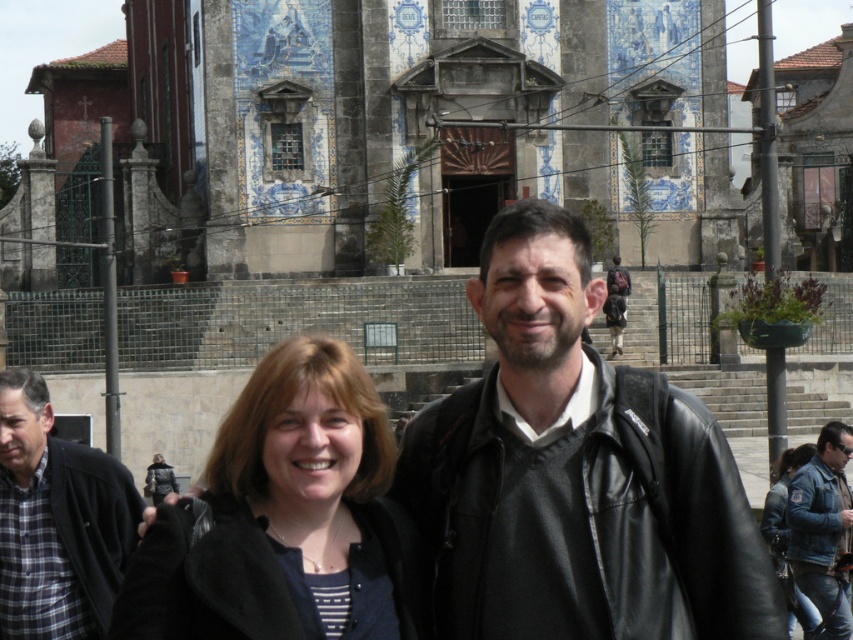
Question: Can you confirm if black leather jacket at center is positioned to the right of black matte jacket at center?

Choices:
 (A) no
 (B) yes

Answer: (B)

Question: Which of these objects is positioned closest to the black matte jacket at center?

Choices:
 (A) plaid fabric shirt at left
 (B) blue denim jeans at lower right
 (C) black leather jacket at center
 (D) denim jacket at lower right

Answer: (C)

Question: Among these points, which one is nearest to the camera?

Choices:
 (A) (782, 554)
 (B) (614, 396)
 (C) (811, 460)

Answer: (B)

Question: Which of the following is the farthest from the observer?

Choices:
 (A) (47, 488)
 (B) (398, 481)
 (C) (785, 563)

Answer: (C)

Question: Is black leather jacket at center positioned behind blue denim jeans at lower right?

Choices:
 (A) yes
 (B) no

Answer: (B)

Question: Is black leather jacket at center below black matte jacket at center?

Choices:
 (A) yes
 (B) no

Answer: (B)